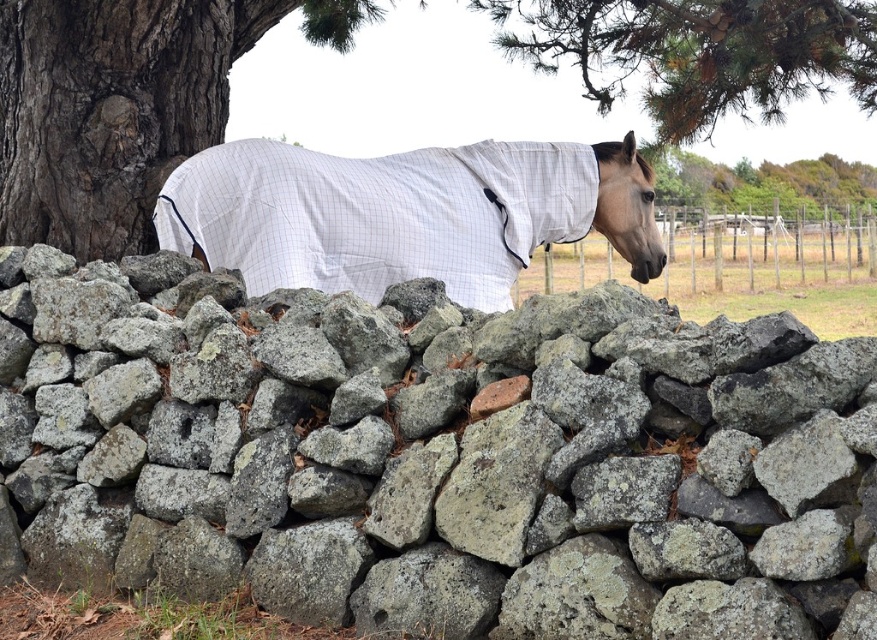
Between green pine needles at upper center and wooden fence at center, which one has more height?

wooden fence at center is taller.

Is green pine needles at upper center to the right of wooden fence at center from the viewer's perspective?

Incorrect, green pine needles at upper center is not on the right side of wooden fence at center.

Where is `green pine needles at upper center`? The image size is (877, 640). green pine needles at upper center is located at coordinates (697, 52).

Is point (535, 145) positioned behind point (820, 170)?

No.

Between white mesh horse at center and green leafy tree at upper center, which one is positioned lower?

white mesh horse at center is lower down.

Is point (508, 228) farther from camera compared to point (858, 164)?

No.

Identify the location of white mesh horse at center. This screenshot has height=640, width=877. (405, 212).

Does green pine needles at upper center have a greater width compared to green leafy tree at upper center?

No.

Locate an element on the screen. green pine needles at upper center is located at coordinates (697, 52).

Identify the location of green pine needles at upper center. The width and height of the screenshot is (877, 640). (697, 52).